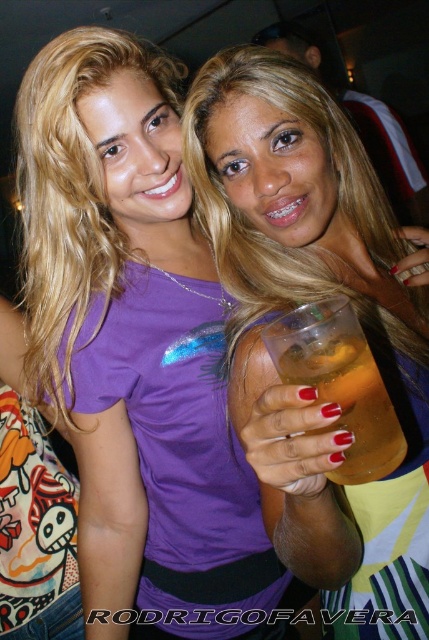
Question: Where is matte plastic cup at center located in relation to translucent plastic cup at center in the image?

Choices:
 (A) left
 (B) right

Answer: (A)

Question: Does matte plastic cup at center appear on the left side of translucent plastic cup at center?

Choices:
 (A) no
 (B) yes

Answer: (B)

Question: Is matte plastic cup at center smaller than translucent plastic cup at center?

Choices:
 (A) no
 (B) yes

Answer: (A)

Question: Which point is farther to the camera?

Choices:
 (A) matte plastic cup at center
 (B) translucent plastic cup at center

Answer: (B)

Question: Among these objects, which one is nearest to the camera?

Choices:
 (A) translucent plastic cup at center
 (B) matte plastic cup at center

Answer: (B)